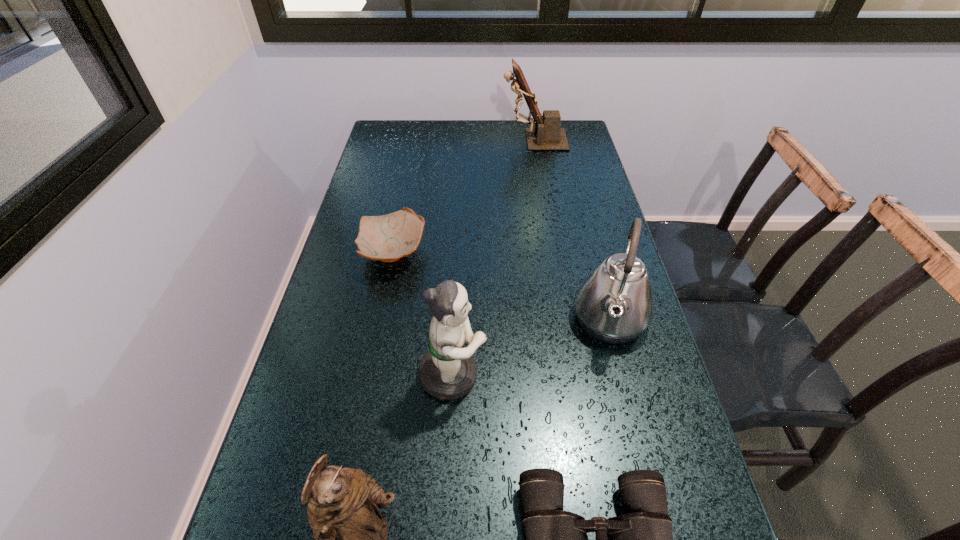
Find the location of a particular element. The image size is (960, 540). vacant space located on the front of the second farthest object is located at coordinates (377, 332).

Identify the location of object that is at the far edge. (547, 135).

Where is `object that is at the left edge`? This screenshot has width=960, height=540. object that is at the left edge is located at coordinates (387, 238).

The image size is (960, 540). I want to click on figurine present at the right edge, so click(547, 135).

The height and width of the screenshot is (540, 960). What are the coordinates of `kettle that is positioned at the right edge` in the screenshot? It's located at (614, 304).

Find the location of `object located in the far right corner section of the desktop`. object located in the far right corner section of the desktop is located at coordinates (547, 135).

Locate an element on the screen. Image resolution: width=960 pixels, height=540 pixels. free space at the far edge of the desktop is located at coordinates (514, 125).

Where is `vacant space at the left edge`? This screenshot has width=960, height=540. vacant space at the left edge is located at coordinates (339, 388).

In order to click on free space at the right edge of the desktop in this screenshot , I will do `click(617, 389)`.

This screenshot has height=540, width=960. I want to click on free area in between the fifth nearest object and the kettle, so click(x=501, y=287).